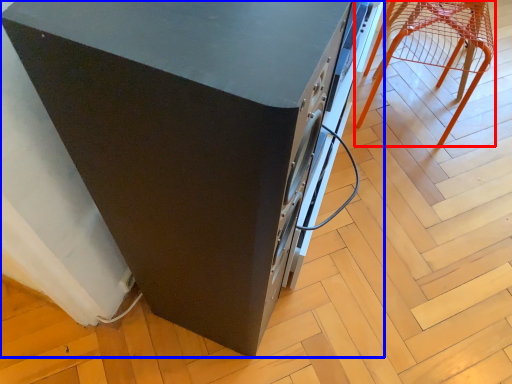
Question: Which point is further to the camera, furniture (highlighted by a red box) or home appliance (highlighted by a blue box)?

Choices:
 (A) furniture
 (B) home appliance

Answer: (A)